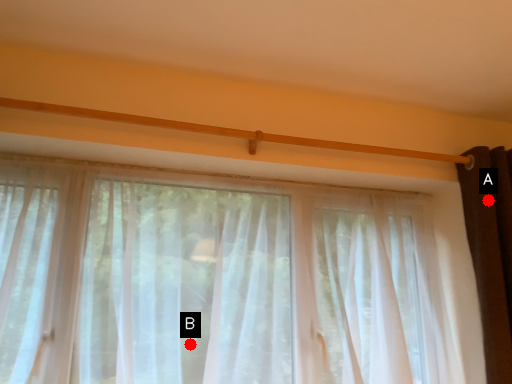
Question: Two points are circled on the image, labeled by A and B beside each circle. Which point is closer to the camera taking this photo?

Choices:
 (A) A is closer
 (B) B is closer

Answer: (B)